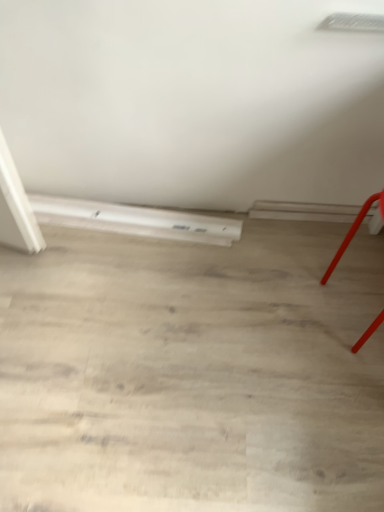
Where is `unoccupied area behind smooth red chair at right`? The image size is (384, 512). unoccupied area behind smooth red chair at right is located at coordinates (x=324, y=249).